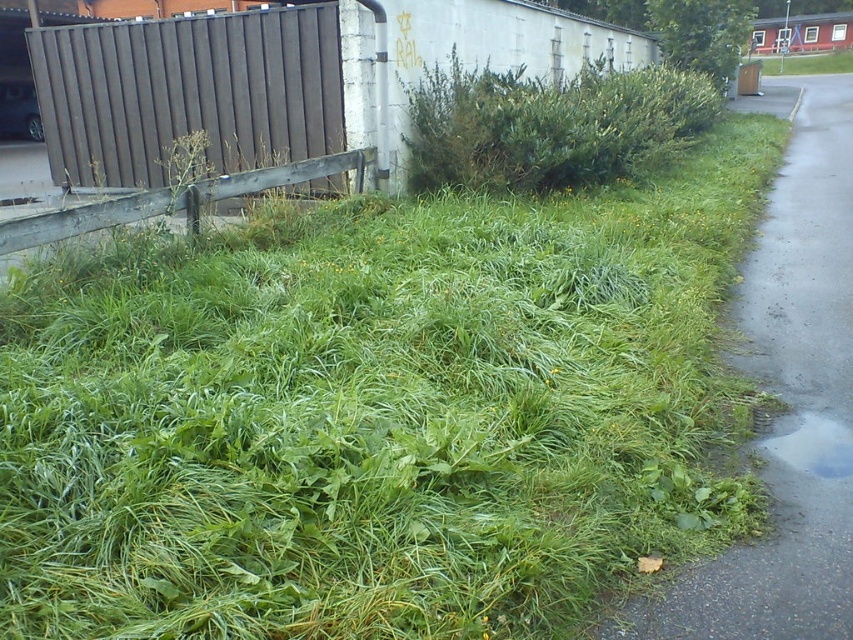
Question: Considering the real-world distances, which object is farthest from the green grass at right?

Choices:
 (A) green leafy bush at upper center
 (B) wooden fence at left
 (C) transparent water at lower right

Answer: (C)

Question: In this image, where is wooden fence at left located relative to transparent water at lower right?

Choices:
 (A) below
 (B) above

Answer: (B)

Question: Which point appears farthest from the camera in this image?

Choices:
 (A) (490, 74)
 (B) (788, 122)

Answer: (B)

Question: Can you confirm if green leafy bush at upper center is positioned above green grass at right?

Choices:
 (A) no
 (B) yes

Answer: (A)

Question: Is gray asphalt pavement at lower right to the right of green grass at right from the viewer's perspective?

Choices:
 (A) yes
 (B) no

Answer: (B)

Question: Which of the following is the farthest from the observer?

Choices:
 (A) brown corrugated metal fence at upper left
 (B) transparent water at lower right
 (C) gray asphalt pavement at lower right
 (D) green grass at right

Answer: (D)